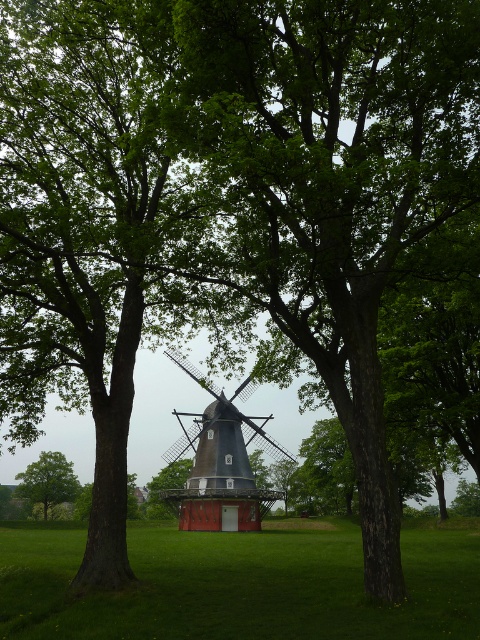
You are planning to place a small garden statue exactly in the middle between the green grass at center and the dark brown wooden windmill at center. Since both objects are at the center, can you determine which direction you should place the statue relative to the windmill to ensure it is centered between them?

The green grass at center is wider than the dark brown wooden windmill at center. Therefore, to place the statue exactly in the middle between them, you should position it slightly towards the direction of the windmill, as the grass occupies more space in the center area.